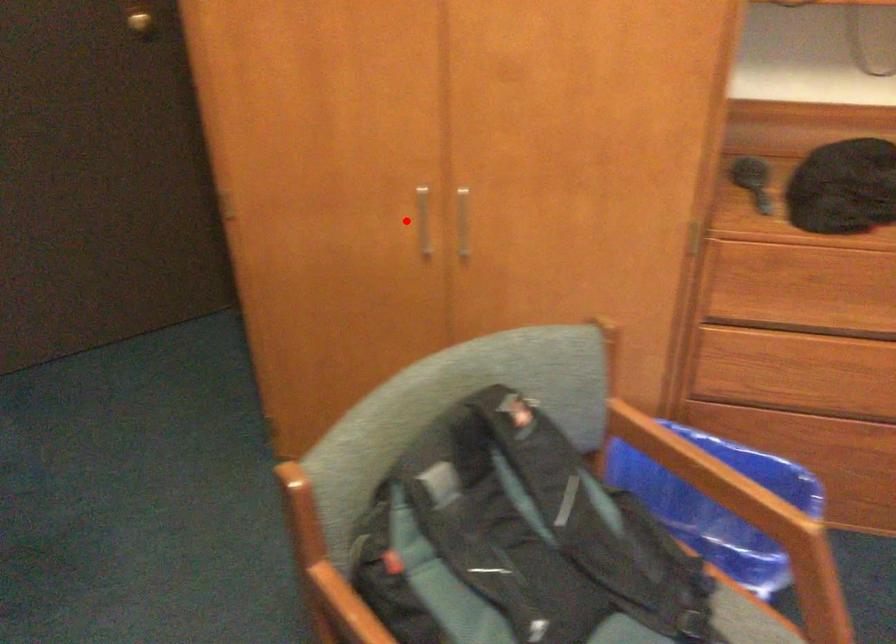
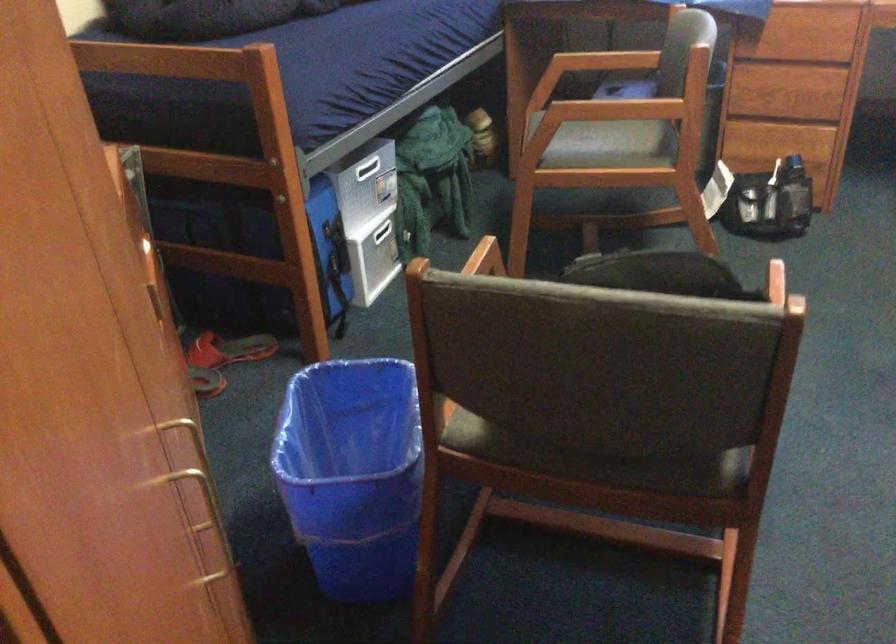
Where in the second image is the point corresponding to the highlighted location from the first image?

(199, 494)